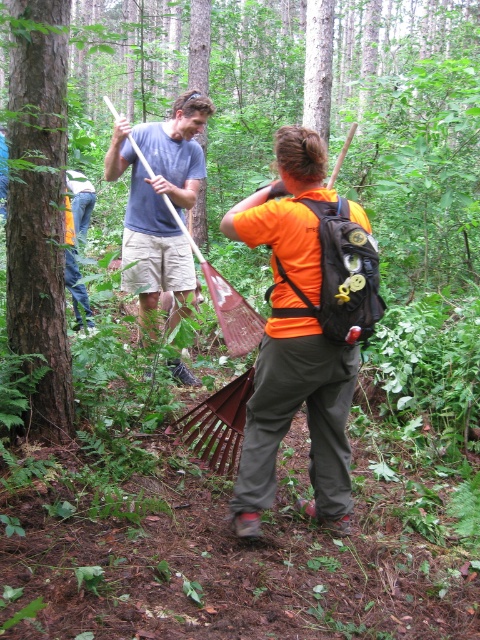
Question: Does metallic rake at center appear on the right side of smooth brown tree trunk at center?

Choices:
 (A) no
 (B) yes

Answer: (B)

Question: Which is farther from the brown rough tree trunk at center?

Choices:
 (A) smooth brown tree trunk at center
 (B) matte blue shirt at upper center
 (C) brown rough tree trunk at center-left
 (D) metallic rake at center

Answer: (C)

Question: Among these points, which one is nearest to the camera?

Choices:
 (A) (179, 378)
 (B) (415, 138)
 (C) (342, 451)

Answer: (C)

Question: Is metallic rake at center to the left of brown rough tree trunk at center from the viewer's perspective?

Choices:
 (A) yes
 (B) no

Answer: (B)

Question: Can you confirm if metallic rake at center is wider than matte blue shirt at upper center?

Choices:
 (A) no
 (B) yes

Answer: (B)

Question: Among these objects, which one is nearest to the camera?

Choices:
 (A) brown rough tree trunk at center-left
 (B) smooth brown tree trunk at center

Answer: (A)